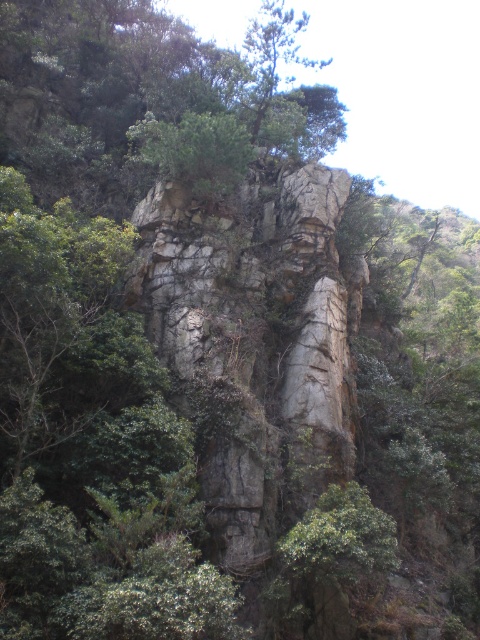
You are standing at the base of the cliff and want to reach the point marked at coordinates point (311, 298). If your climbing gear can handle a maximum distance of 20 meters, will you be able to reach that point?

The distance between you and point (311, 298) is 16.97 meters, which is within the 20 meters maximum distance your climbing gear can handle. Therefore, you can reach the point.

You are an environmental scientist assessing the stability of the rocky cliff at center and the green leafy tree at upper center. Which object has a smaller width according to the scene?

The rocky cliff at center has a lesser width compared to the green leafy tree at upper center, so the rocky cliff at center has a smaller width.

You are a hiker planning to climb the rocky cliff at center and the green leafy tree at upper center. Which one is located more to the left side?

The rocky cliff at center is positioned on the left side of green leafy tree at upper center, so the rocky cliff at center is more to the left.